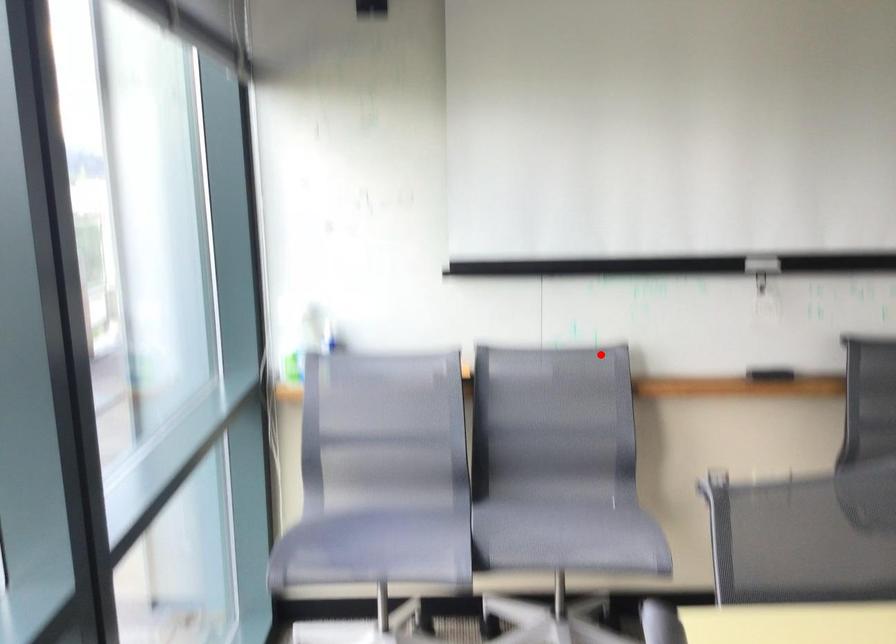
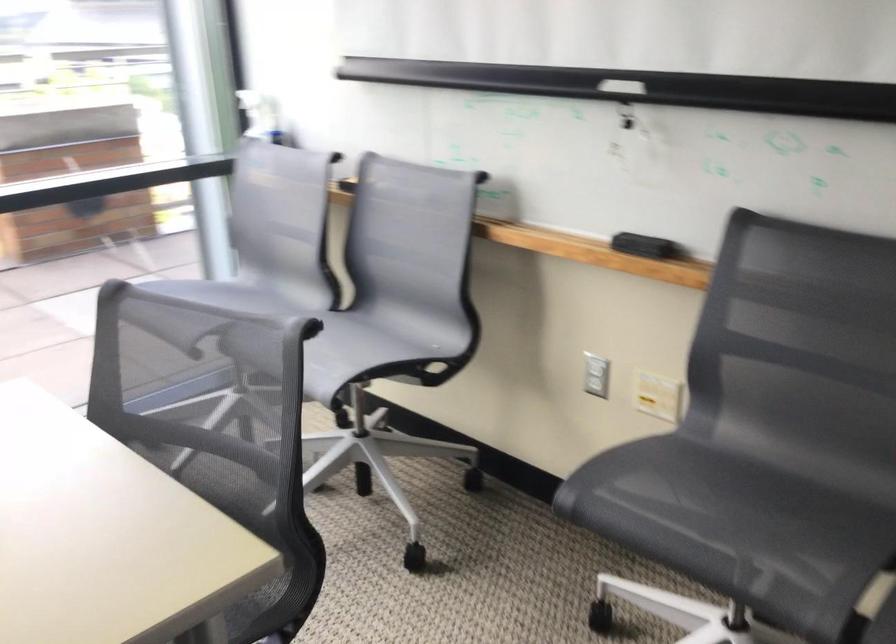
In the second image, find the point that corresponds to the highlighted location in the first image.

(457, 182)